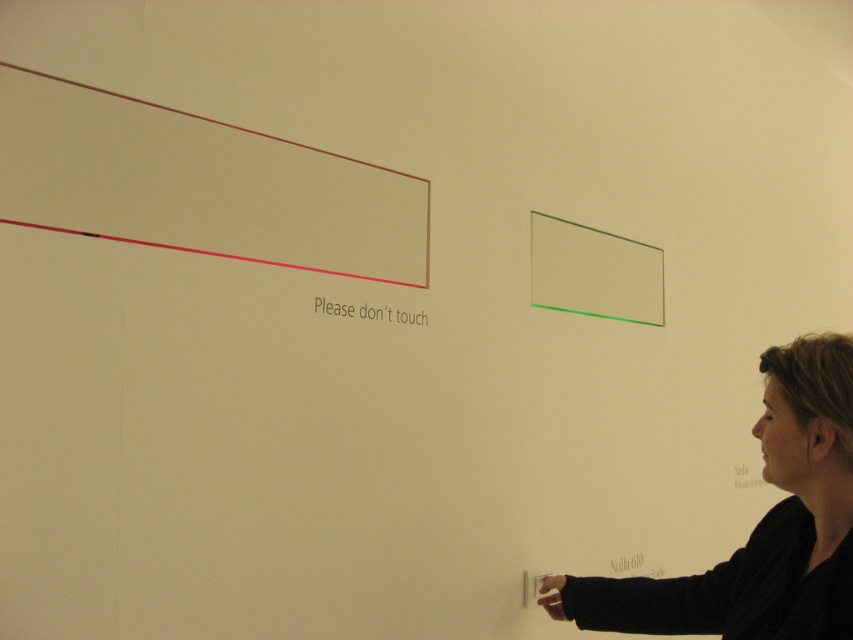
Between point (177, 244) and point (827, 538), which one is positioned behind?

Point (177, 244)

Is matte brown rectangle at upper left thinner than dark brown hair at lower right?

No.

You are a GUI agent. You are given a task and a screenshot of the screen. Output one action in this format:
    pyautogui.click(x=<x>, y=<y>)
    Task: Click on the matte brown rectangle at upper left
    The height and width of the screenshot is (640, 853).
    Given the screenshot: What is the action you would take?
    pyautogui.click(x=200, y=184)

Locate an element on the screen. The height and width of the screenshot is (640, 853). matte brown rectangle at upper left is located at coordinates (200, 184).

Who is lower down, dark brown hair at lower right or white paper at upper center?

dark brown hair at lower right is below.

Is dark brown hair at lower right thinner than white paper at upper center?

No.

At what (x,y) coordinates should I click in order to perform the action: click on dark brown hair at lower right. Please return your answer as a coordinate pair (x, y). The height and width of the screenshot is (640, 853). Looking at the image, I should click on (759, 525).

This screenshot has height=640, width=853. What do you see at coordinates (595, 273) in the screenshot? I see `green matte rectangle at upper right` at bounding box center [595, 273].

Locate an element on the screen. This screenshot has height=640, width=853. green matte rectangle at upper right is located at coordinates (595, 273).

Locate an element on the screen. green matte rectangle at upper right is located at coordinates (595, 273).